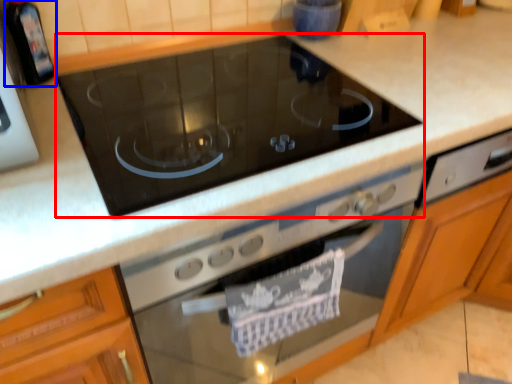
Question: Which object appears farthest to the camera in this image, gas stove (highlighted by a red box) or appliance (highlighted by a blue box)?

Choices:
 (A) gas stove
 (B) appliance

Answer: (B)